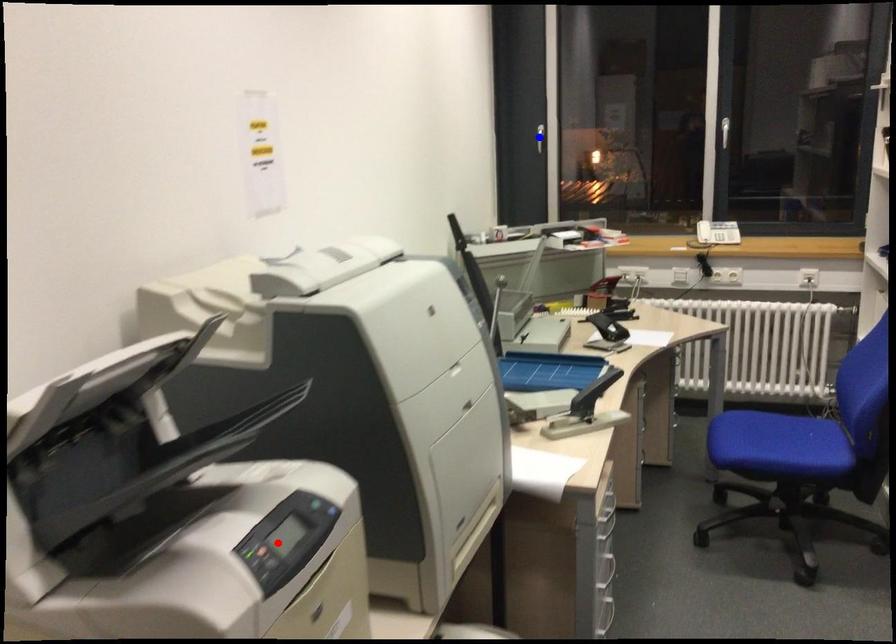
Question: In the image, two points are highlighted. Which point is nearer to the camera? Reply with the corresponding letter.

Choices:
 (A) blue point
 (B) red point

Answer: (B)